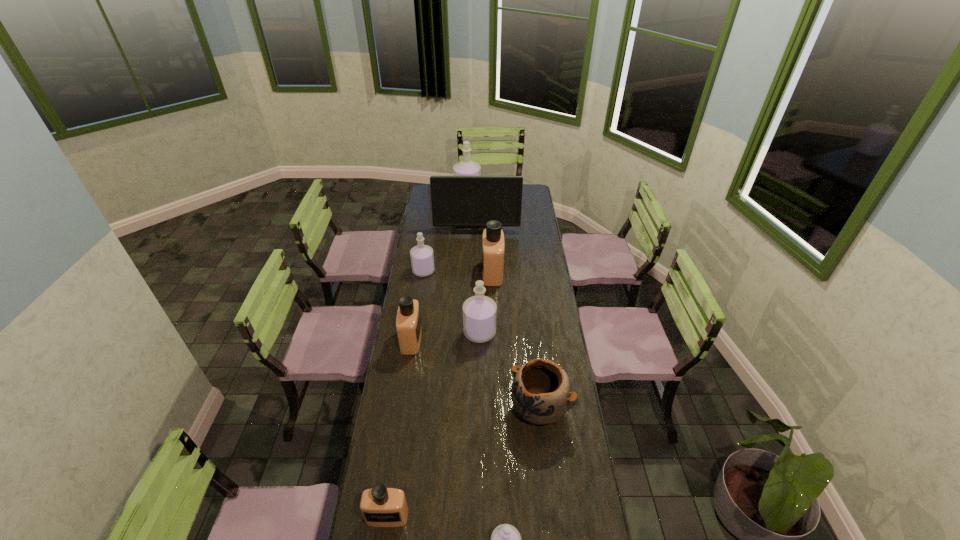
In order to click on vacant space that satisfies the following two spatial constraints: 1. on the screen side of the third nearest object; 2. on the left side of the black computer monitor in this screenshot , I will do `click(475, 408)`.

You are a GUI agent. You are given a task and a screenshot of the screen. Output one action in this format:
    pyautogui.click(x=<x>, y=<y>)
    Task: Click on the vacant space that satisfies the following two spatial constraints: 1. on the screen side of the third smallest purple perfume; 2. on the right side of the computer monitor
    The height and width of the screenshot is (540, 960).
    Given the screenshot: What is the action you would take?
    pyautogui.click(x=476, y=332)